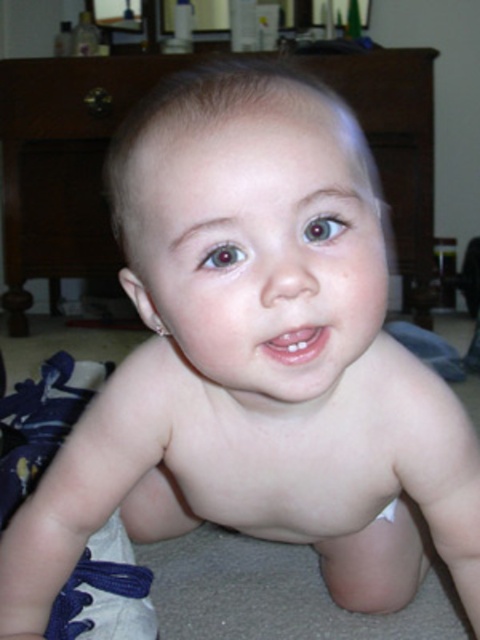
Who is positioned more to the left, blue fabric shoe at lower left or white cloth diaper at lower center?

blue fabric shoe at lower left is more to the left.

Which of these two, blue fabric shoe at lower left or white cloth diaper at lower center, stands taller?

With more height is blue fabric shoe at lower left.

Where is `blue fabric shoe at lower left`? The width and height of the screenshot is (480, 640). blue fabric shoe at lower left is located at coordinates (105, 593).

Can you confirm if brown wood dresser at upper center is smaller than white cloth diaper at lower center?

Actually, brown wood dresser at upper center might be larger than white cloth diaper at lower center.

How much distance is there between brown wood dresser at upper center and white cloth diaper at lower center?

A distance of 1.75 meters exists between brown wood dresser at upper center and white cloth diaper at lower center.

What do you see at coordinates (62, 164) in the screenshot? I see `brown wood dresser at upper center` at bounding box center [62, 164].

Image resolution: width=480 pixels, height=640 pixels. I want to click on brown wood dresser at upper center, so click(x=62, y=164).

Does brown wood dresser at upper center appear on the left side of blue fabric shoe at lower left?

Indeed, brown wood dresser at upper center is positioned on the left side of blue fabric shoe at lower left.

Which is above, brown wood dresser at upper center or blue fabric shoe at lower left?

brown wood dresser at upper center is above.

I want to click on brown wood dresser at upper center, so click(x=62, y=164).